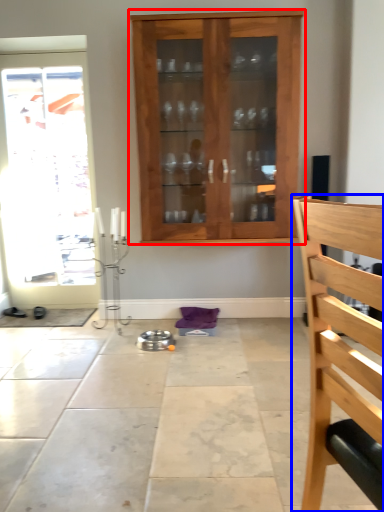
Question: Which point is further to the camera, cabinetry (highlighted by a red box) or chair (highlighted by a blue box)?

Choices:
 (A) cabinetry
 (B) chair

Answer: (A)